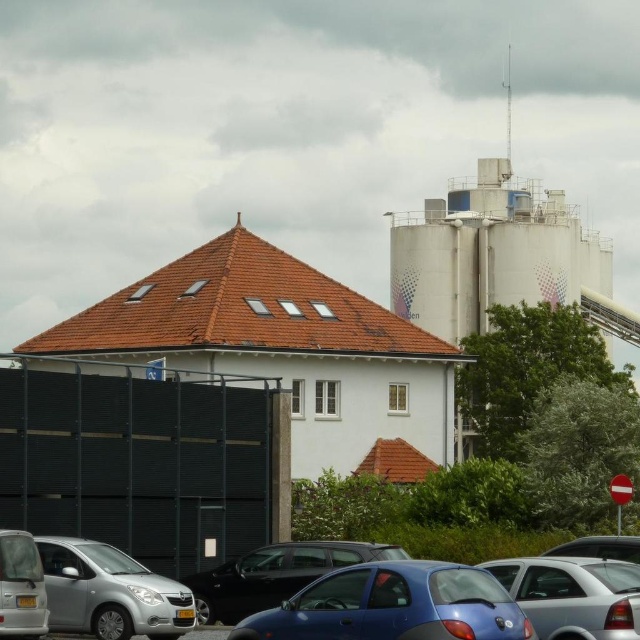
Between point (381, 577) and point (22, 556), which one is positioned behind?

Point (22, 556)

Between metallic blue hatchback at center and silver metallic car at lower left, which one has more height?

Standing taller between the two is metallic blue hatchback at center.

Find the location of a particular element. This screenshot has width=640, height=640. metallic blue hatchback at center is located at coordinates tap(394, 605).

Where is `metallic blue hatchback at center`? Image resolution: width=640 pixels, height=640 pixels. metallic blue hatchback at center is located at coordinates (394, 605).

Is metallic blue hatchback at center further to camera compared to metallic silver car at lower right?

No, metallic blue hatchback at center is closer to the viewer.

Based on the photo, can you confirm if metallic blue hatchback at center is taller than metallic silver car at lower right?

Yes, metallic blue hatchback at center is taller than metallic silver car at lower right.

I want to click on metallic blue hatchback at center, so (x=394, y=605).

Can you confirm if metallic blue hatchback at center is positioned above metallic blue sedan at center?

Incorrect, metallic blue hatchback at center is not positioned above metallic blue sedan at center.

Who is higher up, metallic blue hatchback at center or metallic blue sedan at center?

Positioned higher is metallic blue sedan at center.

Between point (365, 636) and point (554, 577), which one is positioned in front?

Point (365, 636) is more forward.

You are a GUI agent. You are given a task and a screenshot of the screen. Output one action in this format:
    pyautogui.click(x=<x>, y=<y>)
    Task: Click on the metallic blue hatchback at center
    This screenshot has width=640, height=640.
    Given the screenshot: What is the action you would take?
    pyautogui.click(x=394, y=605)